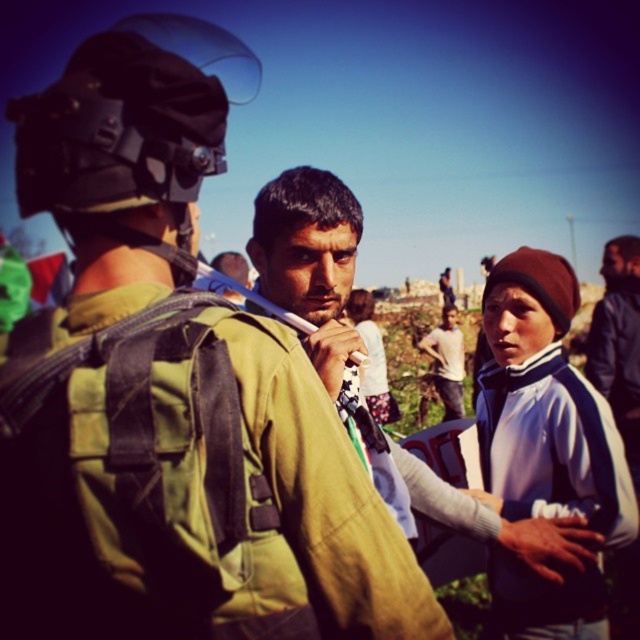
Who is more forward, (x=68, y=490) or (x=449, y=337)?

Point (x=68, y=490) is in front.

Who is positioned more to the left, matte green uniform at center or white fleece jacket at center?

From the viewer's perspective, matte green uniform at center appears more on the left side.

Which is in front, point (246, 426) or point (433, 362)?

Positioned in front is point (246, 426).

Locate an element on the screen. This screenshot has height=640, width=640. matte green uniform at center is located at coordinates (173, 392).

Which is more to the right, matte green uniform at center or blue fleece jacket at right?

Positioned to the right is blue fleece jacket at right.

This screenshot has width=640, height=640. Identify the location of matte green uniform at center. (173, 392).

Is point (160, 548) more distant than point (518, 632)?

No.

Locate an element on the screen. This screenshot has height=640, width=640. matte green uniform at center is located at coordinates click(x=173, y=392).

Who is positioned more to the left, blue fleece jacket at right or white fleece jacket at center?

white fleece jacket at center

Which is more to the right, blue fleece jacket at right or white fleece jacket at center?

blue fleece jacket at right is more to the right.

The image size is (640, 640). Describe the element at coordinates (545, 406) in the screenshot. I see `blue fleece jacket at right` at that location.

Find the location of a particular element. The height and width of the screenshot is (640, 640). blue fleece jacket at right is located at coordinates (545, 406).